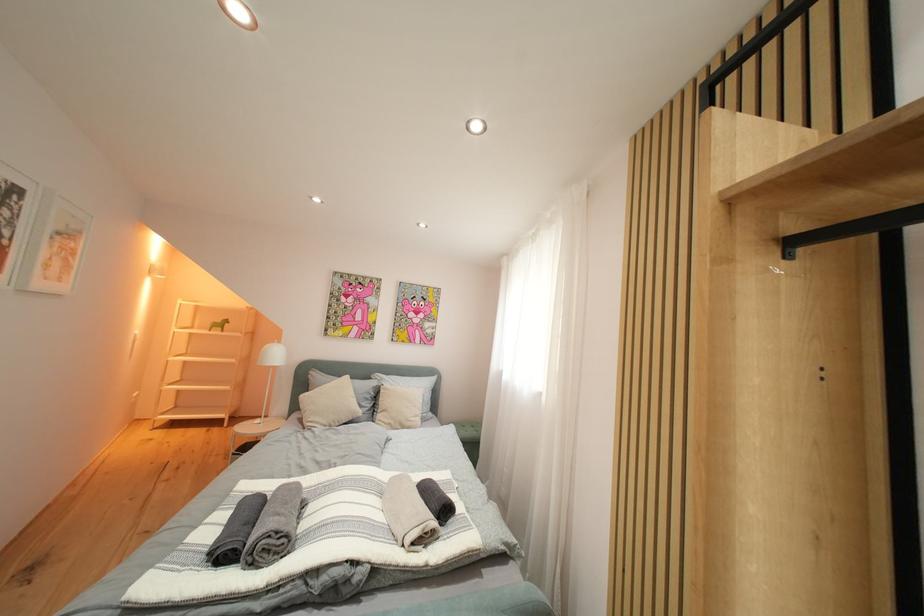
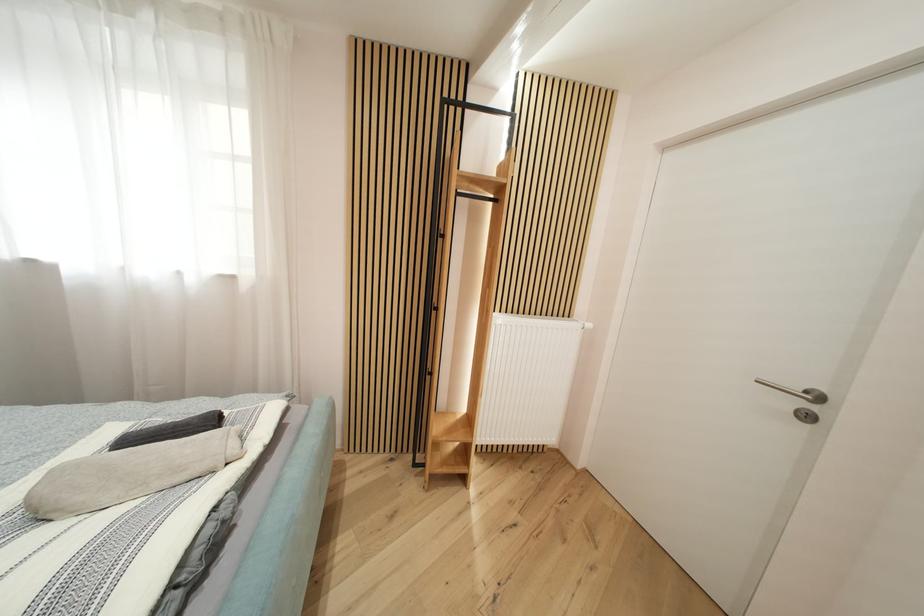
How did the camera likely rotate?

The camera rotated toward right-down.